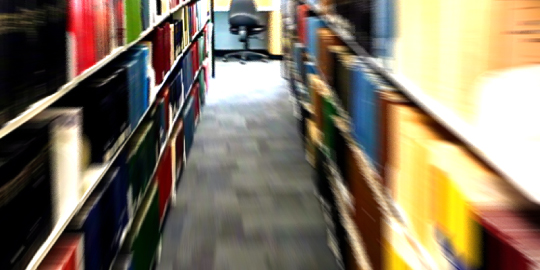
The height and width of the screenshot is (270, 540). I want to click on yellow books, so click(432, 184), click(417, 169), click(472, 46).